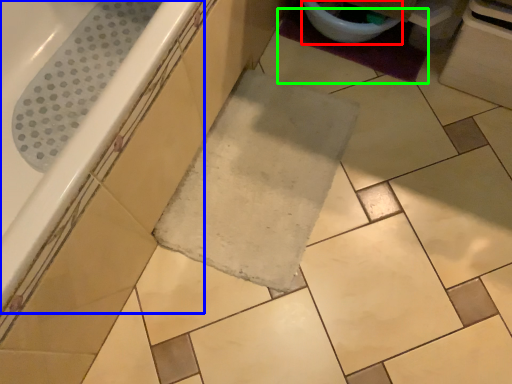
Question: Which object is the closest to the toilet bowl (highlighted by a red box)? Choose among these: bathtub (highlighted by a blue box) or bath mat (highlighted by a green box).

Choices:
 (A) bathtub
 (B) bath mat

Answer: (B)